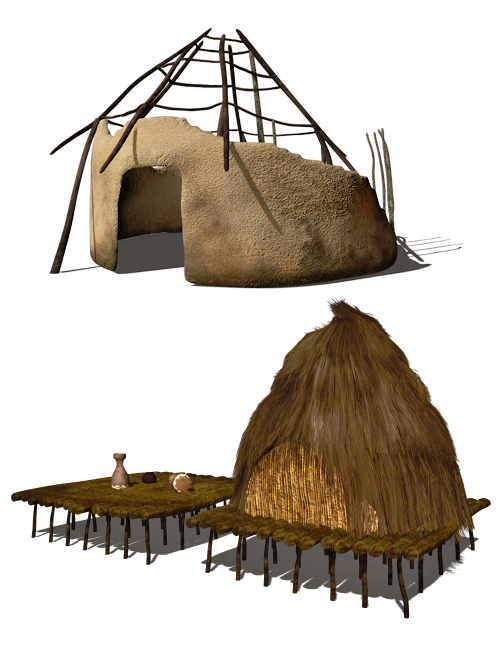
Where is `wall`? This screenshot has height=650, width=500. wall is located at coordinates (219, 221).